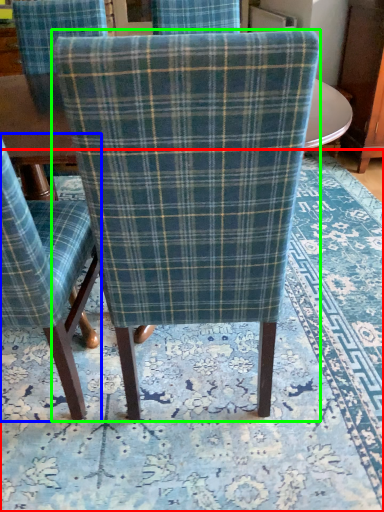
Question: Which object is the closest to the mat (highlighted by a red box)? Choose among these: chair (highlighted by a blue box) or chair (highlighted by a green box).

Choices:
 (A) chair
 (B) chair

Answer: (A)